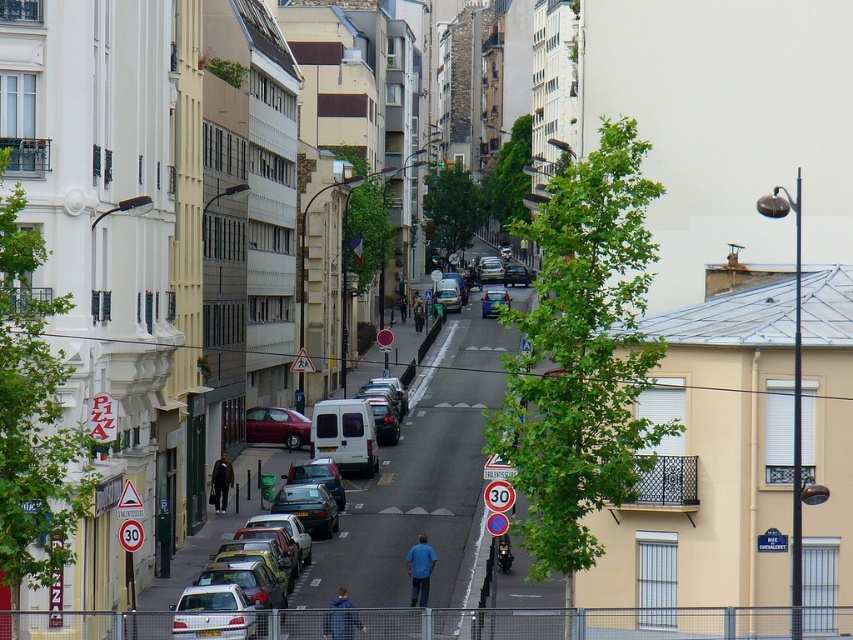
Question: In this image, where is shiny black sedan at center located relative to matte black van at center?

Choices:
 (A) left
 (B) right

Answer: (A)

Question: Can you confirm if silver metallic car at center is positioned above metallic blue car at center?

Choices:
 (A) no
 (B) yes

Answer: (A)

Question: Which point is closer to the camera?

Choices:
 (A) (519, 276)
 (B) (265, 422)
 (C) (322, 525)
 (D) (346, 596)

Answer: (D)

Question: Considering the real-world distances, which object is farthest from the dark gray fabric coat at lower left?

Choices:
 (A) metallic silver car at center
 (B) shiny black sedan at center
 (C) blue cotton shirt at center
 (D) metallic maroon car at center

Answer: (A)

Question: Considering the real-world distances, which object is closest to the dark gray fabric coat at lower left?

Choices:
 (A) blue fabric jacket at lower center
 (B) shiny black sedan at center
 (C) metallic silver car at center

Answer: (B)

Question: Is matte white van at center further to camera compared to metallic blue car at center?

Choices:
 (A) yes
 (B) no

Answer: (B)